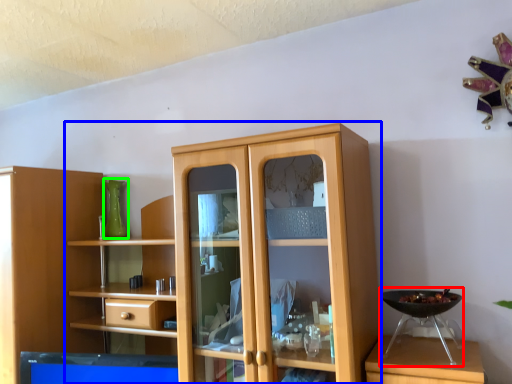
Question: Considering the real-world distances, which object is farthest from appliance (highlighted by a red box)? cupboard (highlighted by a blue box) or glass vase (highlighted by a green box)?

Choices:
 (A) cupboard
 (B) glass vase

Answer: (B)